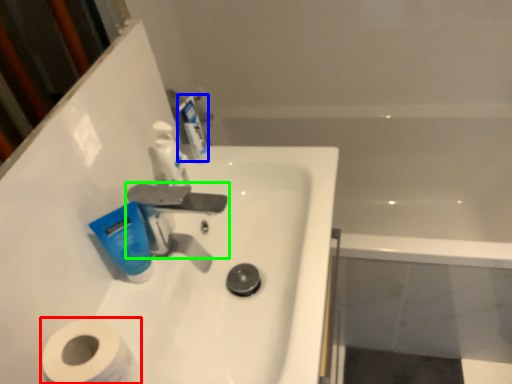
Question: Which is farther away from toilet paper (highlighted by a red box)? mouthwash (highlighted by a blue box) or tap (highlighted by a green box)?

Choices:
 (A) mouthwash
 (B) tap

Answer: (A)